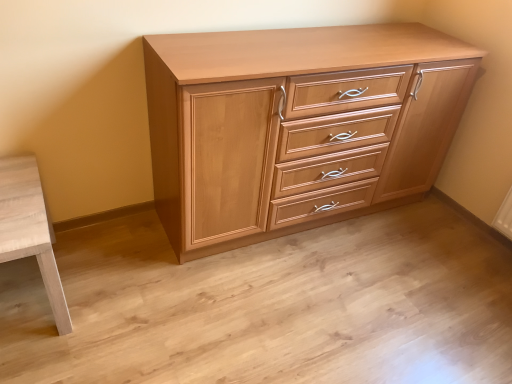
Where is `empty space that is to the right of light wood chest of drawers at center`? empty space that is to the right of light wood chest of drawers at center is located at coordinates [432, 252].